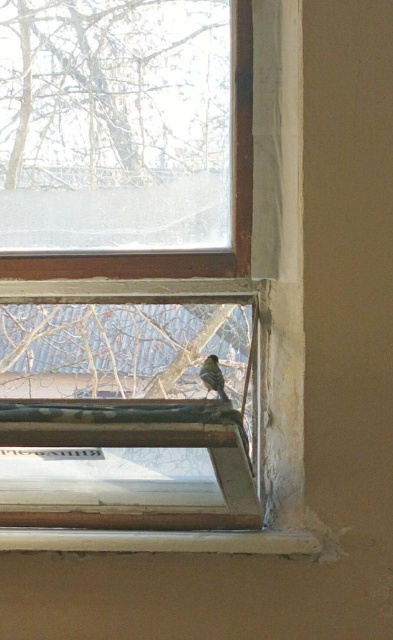
You have a small toy that is 10 cm wide and want to place it on the window sill where the brown fuzzy bird at lower center is perched. The clear glass window at center is adjacent to the bird. Can the toy fit on the same sill without overlapping the window frame?

The clear glass window at center might be wider than brown fuzzy bird at lower center, so there might be enough space on the sill for the 10 cm wide toy without overlapping the frame.

You are looking through the window and notice the wooden frame at lower center and the clear glass window at center. From your perspective, which object is positioned to the right side?

The wooden frame at lower center is to the right of the clear glass window at center.

You are a window cleaner standing 40 inches away from the wooden frame at lower center. Can you reach it without moving closer?

The wooden frame at lower center is 39.27 inches from the camera, so yes, you can reach it without moving closer as you are only 0.73 inches away from the required distance.